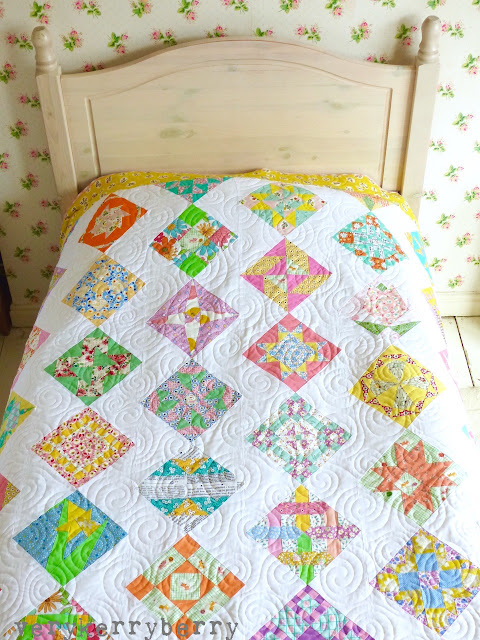
The width and height of the screenshot is (480, 640). I want to click on sheet, so click(x=408, y=198).